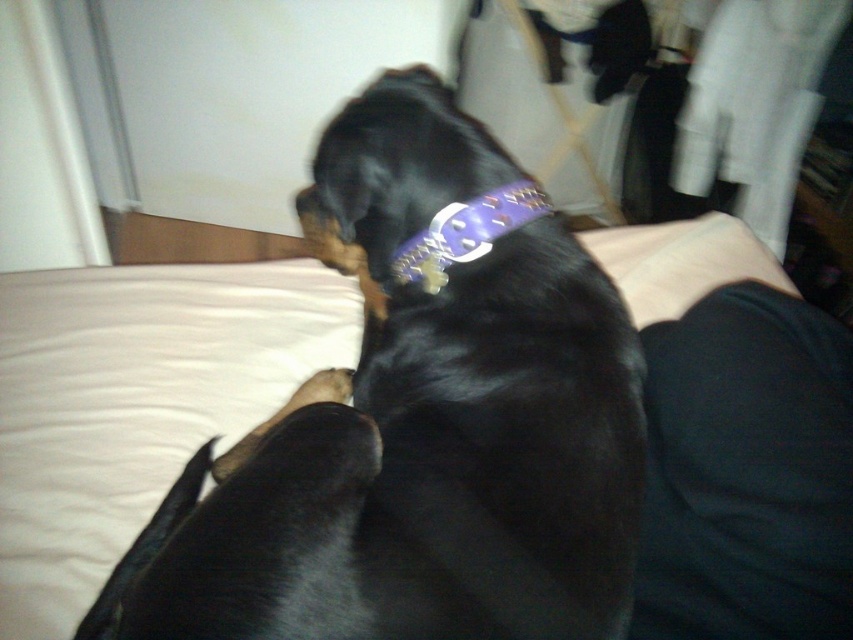
Does black shiny fur dog at center appear on the right side of dark fabric pants at lower right?

No, black shiny fur dog at center is not to the right of dark fabric pants at lower right.

From the picture: Between black shiny fur dog at center and dark fabric pants at lower right, which one appears on the left side from the viewer's perspective?

From the viewer's perspective, black shiny fur dog at center appears more on the left side.

Who is more forward, (506, 253) or (717, 584)?

Positioned in front is point (717, 584).

Locate an element on the screen. This screenshot has height=640, width=853. black shiny fur dog at center is located at coordinates (422, 419).

Is dark fabric pants at lower right further to the viewer compared to purple leather neckband at center?

No, it is not.

Between dark fabric pants at lower right and purple leather neckband at center, which one is positioned higher?

Positioned higher is purple leather neckband at center.

Between point (741, 634) and point (428, 244), which one is positioned in front?

Point (741, 634) is more forward.

I want to click on dark fabric pants at lower right, so click(x=746, y=472).

Between point (618, 368) and point (450, 237), which one is positioned behind?

The point (450, 237) is behind.

Does black shiny fur dog at center appear under purple leather neckband at center?

Yes, black shiny fur dog at center is below purple leather neckband at center.

Does point (408, 556) come in front of point (404, 284)?

Yes, it is.

I want to click on black shiny fur dog at center, so click(x=422, y=419).